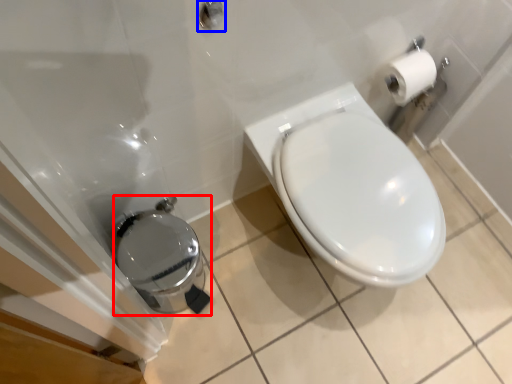
Question: Which object is further to the camera taking this photo, porcelain (highlighted by a red box) or shower (highlighted by a blue box)?

Choices:
 (A) porcelain
 (B) shower

Answer: (A)